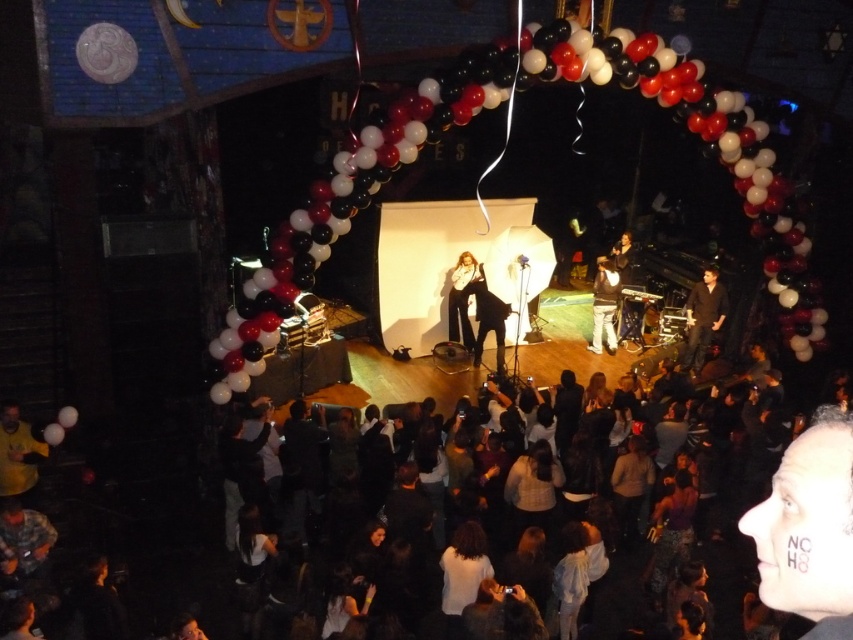
You are a photographer at the back of the venue and want to capture a clear shot of the black leather pants at center without the dark clothing crowd at center blocking the view. Is this possible based on their heights?

The dark clothing crowd at center is shorter than the black leather pants at center, so the photographer can likely capture a clear shot of the black leather pants at center without obstruction from the crowd.

You are a photographer at the event and need to position yourself to capture both the dark brown leather jacket at right and the dark brown leather jacket at lower right in the same frame. Which jacket should you position yourself closer to in order to include both in your shot?

You should position yourself closer to the dark brown leather jacket at lower right because the dark brown leather jacket at right is to the right of it, so by centering on the lower right jacket, both can be captured in the frame.